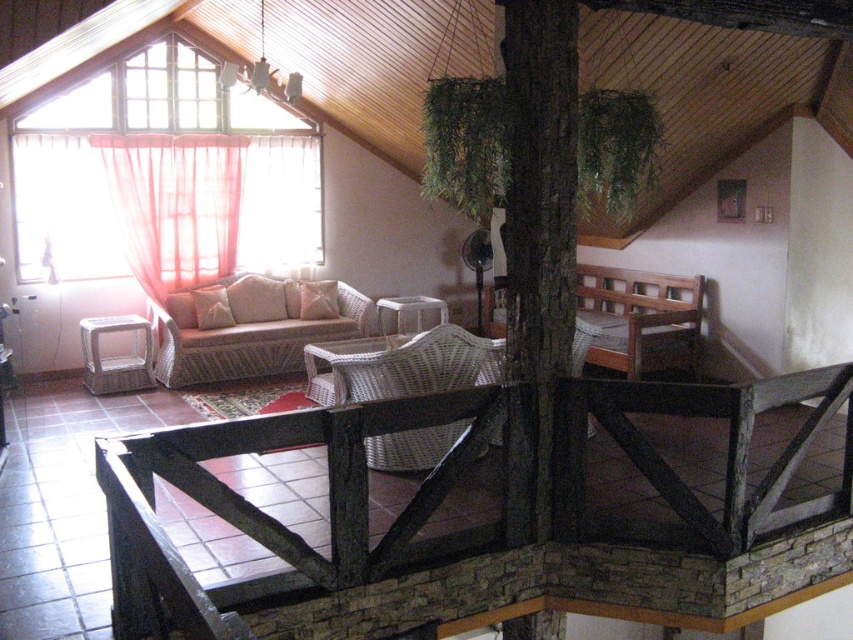
Question: Is woven rattan armchair at center bigger than white woven pillow at center?

Choices:
 (A) yes
 (B) no

Answer: (A)

Question: Is sheer pink curtain at left behind woven rattan chair at lower left?

Choices:
 (A) yes
 (B) no

Answer: (A)

Question: Considering the real-world distances, which object is farthest from the dark brown wooden railing at center?

Choices:
 (A) white woven pillow at center
 (B) woven beige couch at center

Answer: (A)

Question: Does woven beige couch at center appear under beige woven pillow at center?

Choices:
 (A) no
 (B) yes

Answer: (B)

Question: Among these points, which one is farthest from the camera?

Choices:
 (A) (225, 300)
 (B) (129, 525)
 (C) (334, 300)
 (D) (155, 152)

Answer: (C)

Question: Among these points, which one is nearest to the camera?

Choices:
 (A) pos(119,204)
 (B) pos(117,365)

Answer: (B)